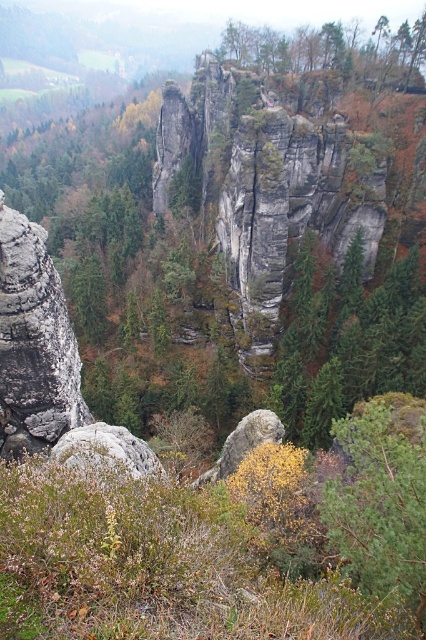
Question: From the image, what is the correct spatial relationship of green matte tree at center in relation to brown textured tree at upper center?

Choices:
 (A) above
 (B) below

Answer: (B)

Question: Does green matte tree at center appear on the right side of rough gray rock at left?

Choices:
 (A) yes
 (B) no

Answer: (A)

Question: Which of the following is the closest to the observer?

Choices:
 (A) (356, 348)
 (B) (14, 454)
 (C) (278, 72)

Answer: (B)

Question: Is green matte tree at center bigger than green textured tree at lower right?

Choices:
 (A) yes
 (B) no

Answer: (A)

Question: Which of these objects is positioned farthest from the brown textured tree at upper center?

Choices:
 (A) green textured tree at lower right
 (B) green matte tree at center
 (C) rough gray rock at left

Answer: (A)

Question: Among these objects, which one is nearest to the camera?

Choices:
 (A) brown textured tree at upper center
 (B) green matte tree at center

Answer: (B)